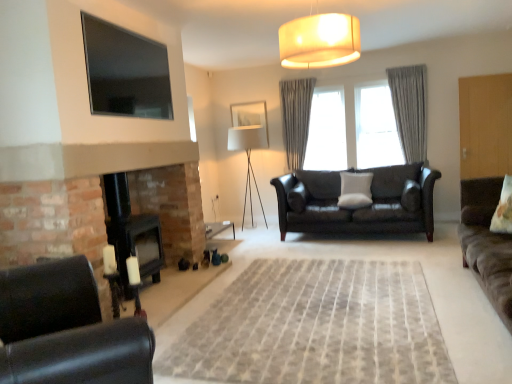
Question: Is flat-screen tv at upper left facing towards matte beige lampshade at upper center?

Choices:
 (A) no
 (B) yes

Answer: (B)

Question: Is flat-screen tv at upper left far away from matte beige lampshade at upper center?

Choices:
 (A) yes
 (B) no

Answer: (A)

Question: Can you confirm if flat-screen tv at upper left is thinner than matte beige lampshade at upper center?

Choices:
 (A) yes
 (B) no

Answer: (A)

Question: Is matte beige lampshade at upper center located within flat-screen tv at upper left?

Choices:
 (A) yes
 (B) no

Answer: (B)

Question: From the image's perspective, is flat-screen tv at upper left below matte beige lampshade at upper center?

Choices:
 (A) yes
 (B) no

Answer: (A)

Question: Would you say white fabric lamp at center is inside or outside gray textured curtain at center, the first curtain in the right-to-left sequence?

Choices:
 (A) inside
 (B) outside

Answer: (B)

Question: In terms of height, does white fabric lamp at center look taller or shorter compared to gray textured curtain at center, the first curtain in the right-to-left sequence?

Choices:
 (A) tall
 (B) short

Answer: (A)

Question: Is white fabric lamp at center bigger or smaller than gray textured curtain at center, the 2th curtain positioned from the left?

Choices:
 (A) small
 (B) big

Answer: (B)

Question: Considering the relative positions of white fabric lamp at center and gray textured curtain at center, the 2th curtain positioned from the left, in the image provided, is white fabric lamp at center to the left or to the right of gray textured curtain at center, the 2th curtain positioned from the left,?

Choices:
 (A) right
 (B) left

Answer: (B)

Question: In terms of width, does black leather chair at lower left look wider or thinner when compared to gray textured curtain at center, the 2th curtain positioned from the left?

Choices:
 (A) thin
 (B) wide

Answer: (A)

Question: Is black leather chair at lower left in front of or behind gray textured curtain at center, the first curtain in the right-to-left sequence, in the image?

Choices:
 (A) front
 (B) behind

Answer: (A)

Question: Based on their sizes in the image, would you say black leather chair at lower left is bigger or smaller than gray textured curtain at center, the first curtain in the right-to-left sequence?

Choices:
 (A) small
 (B) big

Answer: (B)

Question: From the image's perspective, is black leather chair at lower left located above or below gray textured curtain at center, the 2th curtain positioned from the left?

Choices:
 (A) below
 (B) above

Answer: (A)

Question: In terms of width, does gray textured curtain at center, the first curtain in the right-to-left sequence, look wider or thinner when compared to white fabric lamp at center?

Choices:
 (A) wide
 (B) thin

Answer: (B)

Question: Looking at the image, does gray textured curtain at center, the 2th curtain positioned from the left, seem bigger or smaller compared to white fabric lamp at center?

Choices:
 (A) big
 (B) small

Answer: (B)